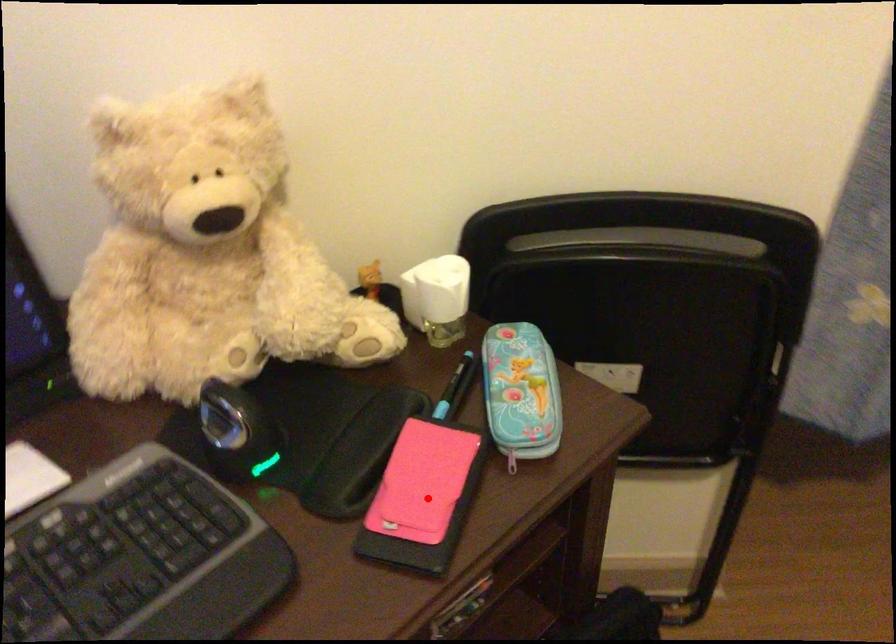
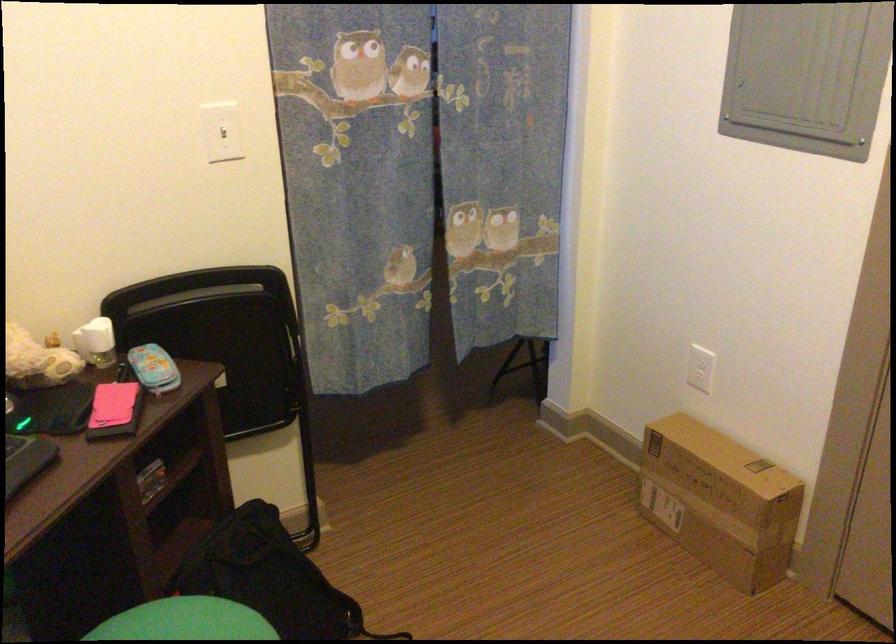
Question: I am providing you with two images of the same scene from different viewpoints. A red point is shown in image1. For the corresponding object point in image2, is it positioned nearer or farther from the camera?

Choices:
 (A) Nearer
 (B) Farther

Answer: (B)